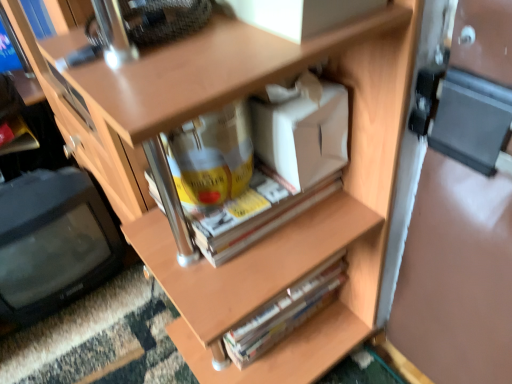
This screenshot has height=384, width=512. What do you see at coordinates (286, 312) in the screenshot? I see `hardcover book at center` at bounding box center [286, 312].

What do you see at coordinates (52, 242) in the screenshot? I see `black plastic computer monitor at left` at bounding box center [52, 242].

This screenshot has width=512, height=384. I want to click on white cardboard box at center, so click(x=301, y=133).

The width and height of the screenshot is (512, 384). I want to click on hardcover book at center, so click(286, 312).

From a real-world perspective, which is physically above, hardcover book at center or black plastic computer monitor at left?

black plastic computer monitor at left is physically above.

Identify the location of computer monitor located above the hardcover book at center (from the image's perspective). The image size is (512, 384). (52, 242).

Does hardcover book at center come behind black plastic computer monitor at left?

No, the depth of hardcover book at center is less than that of black plastic computer monitor at left.

Locate an element on the screen. The image size is (512, 384). box in front of the black plastic computer monitor at left is located at coordinates (301, 133).

Is white cardboard box at center looking in the opposite direction of black plastic computer monitor at left?

No, white cardboard box at center is not facing away from black plastic computer monitor at left.

Which of these two, white cardboard box at center or black plastic computer monitor at left, is smaller?

white cardboard box at center is smaller.

Measure the distance from white cardboard box at center to black plastic computer monitor at left.

A distance of 26.90 inches exists between white cardboard box at center and black plastic computer monitor at left.

Can you confirm if white cardboard box at center is bigger than hardcover book at center?

Incorrect, white cardboard box at center is not larger than hardcover book at center.

Is white cardboard box at center closer to camera compared to hardcover book at center?

Yes, white cardboard box at center is in front of hardcover book at center.

Identify the location of paperback book lying on the left of white cardboard box at center. The height and width of the screenshot is (384, 512). (286, 312).

Does black plastic computer monitor at left have a larger size compared to white cardboard box at center?

Indeed, black plastic computer monitor at left has a larger size compared to white cardboard box at center.

From a real-world perspective, is black plastic computer monitor at left positioned under white cardboard box at center based on gravity?

Yes, from a real-world perspective, black plastic computer monitor at left is beneath white cardboard box at center.

Is black plastic computer monitor at left next to white cardboard box at center?

No, black plastic computer monitor at left is not with white cardboard box at center.

Does point (34, 261) come behind point (340, 274)?

Yes, it is.

Is black plastic computer monitor at left in contact with hardcover book at center?

No, black plastic computer monitor at left is not touching hardcover book at center.

Between black plastic computer monitor at left and hardcover book at center, which one has less height?

hardcover book at center.

Find the location of `paperback book directly beneath the white cardboard box at center (from a real-world perspective)`. paperback book directly beneath the white cardboard box at center (from a real-world perspective) is located at coordinates (286, 312).

Does hardcover book at center appear on the right side of white cardboard box at center?

In fact, hardcover book at center is to the left of white cardboard box at center.

Could you tell me if hardcover book at center is facing white cardboard box at center?

No, hardcover book at center is not oriented towards white cardboard box at center.

Is hardcover book at center situated inside white cardboard box at center or outside?

hardcover book at center exists outside the volume of white cardboard box at center.

This screenshot has width=512, height=384. I want to click on computer monitor on the left side of hardcover book at center, so click(52, 242).

The image size is (512, 384). Identify the location of computer monitor behind the white cardboard box at center. (52, 242).

Considering their positions, is hardcover book at center positioned further to black plastic computer monitor at left than white cardboard box at center?

white cardboard box at center.

From the image, which object appears to be farther from white cardboard box at center, hardcover book at center or black plastic computer monitor at left?

Based on the image, black plastic computer monitor at left appears to be further to white cardboard box at center.

Estimate the real-world distances between objects in this image. Which object is closer to hardcover book at center, white cardboard box at center or black plastic computer monitor at left?

The object closer to hardcover book at center is white cardboard box at center.

Looking at the image, which one is located further to black plastic computer monitor at left, white cardboard box at center or hardcover book at center?

Based on the image, white cardboard box at center appears to be further to black plastic computer monitor at left.

Which object lies nearer to the anchor point hardcover book at center, black plastic computer monitor at left or white cardboard box at center?

white cardboard box at center is closer to hardcover book at center.

Looking at the image, which one is located further to white cardboard box at center, black plastic computer monitor at left or hardcover book at center?

black plastic computer monitor at left.

Find the location of a particular element. This screenshot has height=384, width=512. paperback book situated between black plastic computer monitor at left and white cardboard box at center from left to right is located at coordinates (286, 312).